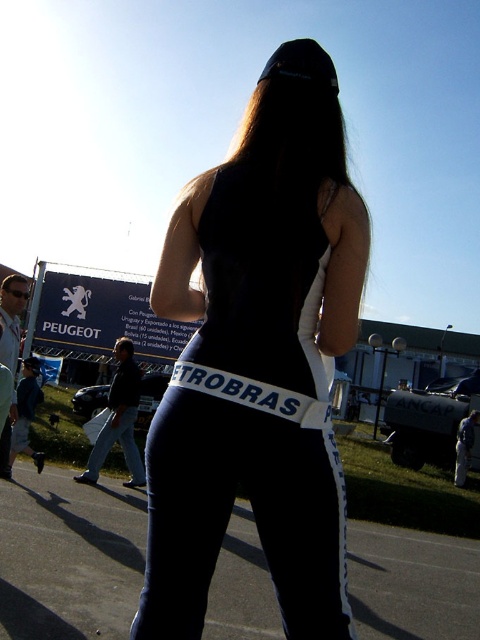
You are standing in the outdoor scene and want to walk to the closest point between point (278, 237) and point (339, 516). Which point should you head towards?

Point (278, 237) is closer to you than point (339, 516), so you should head towards point (278, 237).

You are a fashion designer observing the person in the image. You need to determine if the black matte tank top at center is visible over the navy blue leggings at center. Can you confirm this?

The black matte tank top at center is positioned over the navy blue leggings at center, so yes, the tank top is visible over the leggings.